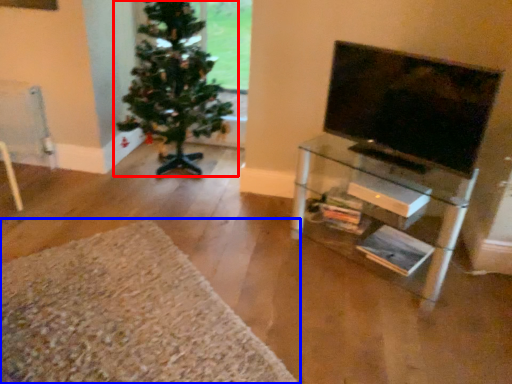
Question: Which object is closer to the camera taking this photo, christmas tree (highlighted by a red box) or plain (highlighted by a blue box)?

Choices:
 (A) christmas tree
 (B) plain

Answer: (B)